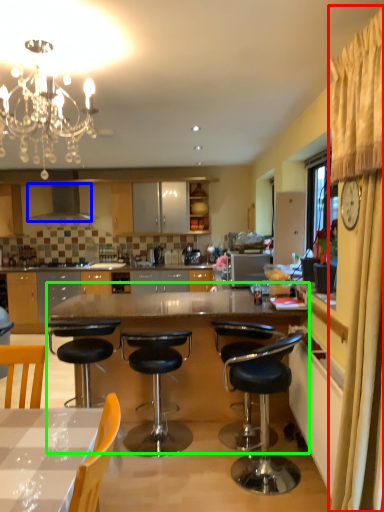
Question: Which object is positioned closest to curtain (highlighted by a red box)? Select from kitchen appliance (highlighted by a blue box) and table (highlighted by a green box).

Choices:
 (A) kitchen appliance
 (B) table

Answer: (B)